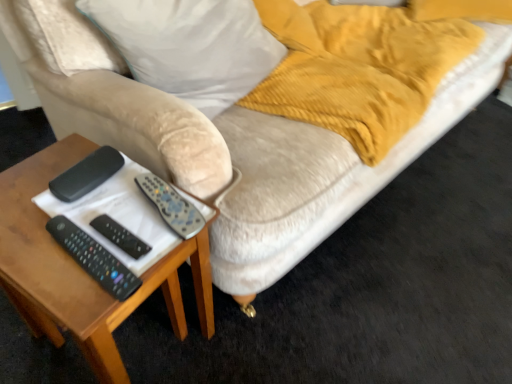
Where is `vacant area on top of wooden table at lower left (from a real-world perspective)`? vacant area on top of wooden table at lower left (from a real-world perspective) is located at coordinates (79, 215).